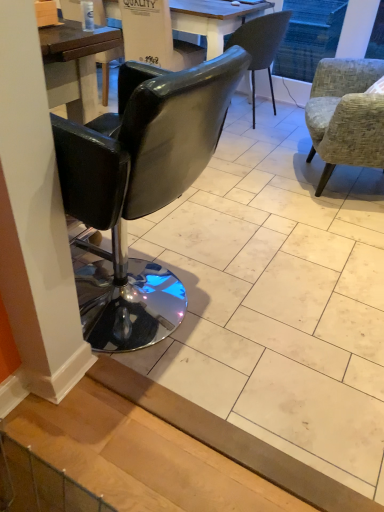
You are a GUI agent. You are given a task and a screenshot of the screen. Output one action in this format:
    pyautogui.click(x=<x>, y=<y>)
    Task: Click on the matte gray chair at center, acting as the 2th chair starting from the right
    
    Given the screenshot: What is the action you would take?
    pyautogui.click(x=261, y=45)

Locate an element on the screen. black leather armchair at center is located at coordinates (155, 36).

Considering the points (99, 219) and (271, 55), which point is in front, point (99, 219) or point (271, 55)?

The point (99, 219) is more forward.

From a real-world perspective, is black leather chair at left, which ranks as the 3th chair in right-to-left order, located higher than matte gray chair at center, marked as the 2th chair in a left-to-right arrangement?

Correct, in the physical world, black leather chair at left, which ranks as the 3th chair in right-to-left order, is higher than matte gray chair at center, marked as the 2th chair in a left-to-right arrangement.

Does black leather chair at left, acting as the first chair starting from the left, contain matte gray chair at center, acting as the 2th chair starting from the right?

No, matte gray chair at center, acting as the 2th chair starting from the right, is not inside black leather chair at left, acting as the first chair starting from the left.

Is matte gray chair at center, marked as the 2th chair in a left-to-right arrangement, not near black leather armchair at center?

That's not correct — matte gray chair at center, marked as the 2th chair in a left-to-right arrangement, is a little close to black leather armchair at center.

From a real-world perspective, is matte gray chair at center, marked as the 2th chair in a left-to-right arrangement, above or below black leather armchair at center?

matte gray chair at center, marked as the 2th chair in a left-to-right arrangement, is below black leather armchair at center.

From the picture: How distant is matte gray chair at center, acting as the first chair starting from the back, from black leather armchair at center?

A distance of 19.46 inches exists between matte gray chair at center, acting as the first chair starting from the back, and black leather armchair at center.

Is matte gray chair at center, acting as the 2th chair starting from the right, facing away from black leather armchair at center?

No, matte gray chair at center, acting as the 2th chair starting from the right,'s orientation is not away from black leather armchair at center.

Is point (256, 62) more distant than point (127, 210)?

Yes.

Which is more to the right, matte gray chair at center, acting as the 2th chair starting from the right, or black leather chair at left, marked as the first chair in a front-to-back arrangement?

From the viewer's perspective, matte gray chair at center, acting as the 2th chair starting from the right, appears more on the right side.

Is black leather chair at left, which is counted as the third chair, starting from the back, surrounded by matte gray chair at center, acting as the first chair starting from the back?

No, black leather chair at left, which is counted as the third chair, starting from the back, is not inside matte gray chair at center, acting as the first chair starting from the back.

In terms of size, does matte gray chair at center, marked as the 2th chair in a left-to-right arrangement, appear bigger or smaller than black leather chair at left, which is counted as the third chair, starting from the back?

matte gray chair at center, marked as the 2th chair in a left-to-right arrangement, is smaller than black leather chair at left, which is counted as the third chair, starting from the back.

Relative to textured gray fabric armchair at right, which ranks as the 3th chair in left-to-right order, is matte gray chair at center, acting as the first chair starting from the back, in front or behind?

Clearly, matte gray chair at center, acting as the first chair starting from the back, is behind textured gray fabric armchair at right, which ranks as the 3th chair in left-to-right order.

Is matte gray chair at center, marked as the 2th chair in a left-to-right arrangement, bigger than textured gray fabric armchair at right, which ranks as the 3th chair in left-to-right order?

No.

Is matte gray chair at center, acting as the first chair starting from the back, oriented towards textured gray fabric armchair at right, which ranks as the 3th chair in left-to-right order?

No, matte gray chair at center, acting as the first chair starting from the back, is not turned towards textured gray fabric armchair at right, which ranks as the 3th chair in left-to-right order.

Would you consider matte gray chair at center, acting as the 3th chair starting from the front, to be distant from textured gray fabric armchair at right, which is the 2th chair in front-to-back order?

No, matte gray chair at center, acting as the 3th chair starting from the front, is in close proximity to textured gray fabric armchair at right, which is the 2th chair in front-to-back order.

At what (x,y) coordinates should I click in order to perform the action: click on armchair in front of the matte gray chair at center, acting as the first chair starting from the back. Please return your answer as a coordinate pair (x, y). This screenshot has height=512, width=384. Looking at the image, I should click on (155, 36).

Does point (143, 26) come farther from viewer compared to point (263, 16)?

That is True.

From a real-world perspective, is black leather armchair at center under matte gray chair at center, acting as the 3th chair starting from the front?

No, from a real-world perspective, black leather armchair at center is not below matte gray chair at center, acting as the 3th chair starting from the front.

Would you say black leather armchair at center is to the left or to the right of matte gray chair at center, acting as the 2th chair starting from the right, in the picture?

black leather armchair at center is to the left of matte gray chair at center, acting as the 2th chair starting from the right.

From a real-world perspective, is black leather chair at left, which ranks as the 3th chair in right-to-left order, below black leather armchair at center?

Yes.

Would you say black leather chair at left, which ranks as the 3th chair in right-to-left order, contains black leather armchair at center?

No.

In the scene shown: Considering the relative sizes of textured gray fabric armchair at right, which ranks as the 3th chair in left-to-right order, and matte gray chair at center, acting as the first chair starting from the back, in the image provided, is textured gray fabric armchair at right, which ranks as the 3th chair in left-to-right order, smaller than matte gray chair at center, acting as the first chair starting from the back,?

Actually, textured gray fabric armchair at right, which ranks as the 3th chair in left-to-right order, might be larger than matte gray chair at center, acting as the first chair starting from the back.

Which of these two, textured gray fabric armchair at right, which ranks as the 3th chair in left-to-right order, or matte gray chair at center, acting as the 2th chair starting from the right, is thinner?

Thinner between the two is matte gray chair at center, acting as the 2th chair starting from the right.

Where is `chair that is the 1st object to the left of the textured gray fabric armchair at right, which is counted as the 2th chair, starting from the back, starting at the anchor`? The width and height of the screenshot is (384, 512). chair that is the 1st object to the left of the textured gray fabric armchair at right, which is counted as the 2th chair, starting from the back, starting at the anchor is located at coordinates (261, 45).

What are the coordinates of `chair above the matte gray chair at center, marked as the 2th chair in a left-to-right arrangement (from a real-world perspective)` in the screenshot? It's located at click(x=140, y=190).

Locate an element on the screen. This screenshot has width=384, height=512. armchair that appears above the matte gray chair at center, acting as the 3th chair starting from the front (from the image's perspective) is located at coordinates (155, 36).

When comparing their distances from black leather armchair at center, does matte gray chair at center, acting as the 2th chair starting from the right, or black leather chair at left, acting as the first chair starting from the left, seem closer?

matte gray chair at center, acting as the 2th chair starting from the right, is positioned closer to the anchor black leather armchair at center.

Which object lies nearer to the anchor point matte gray chair at center, acting as the 3th chair starting from the front, black leather chair at left, which ranks as the 3th chair in right-to-left order, or black leather armchair at center?

The object closer to matte gray chair at center, acting as the 3th chair starting from the front, is black leather armchair at center.

Estimate the real-world distances between objects in this image. Which object is closer to matte gray chair at center, acting as the 3th chair starting from the front, textured gray fabric armchair at right, which ranks as the 3th chair in left-to-right order, or black leather armchair at center?

black leather armchair at center lies closer to matte gray chair at center, acting as the 3th chair starting from the front, than the other object.

Consider the image. Considering their positions, is black leather armchair at center positioned closer to textured gray fabric armchair at right, which ranks as the 3th chair in left-to-right order, than black leather chair at left, which ranks as the 3th chair in right-to-left order?

Based on the image, black leather armchair at center appears to be nearer to textured gray fabric armchair at right, which ranks as the 3th chair in left-to-right order.

When comparing their distances from black leather armchair at center, does black leather chair at left, which ranks as the 3th chair in right-to-left order, or textured gray fabric armchair at right, which is the 2th chair in front-to-back order, seem further?

black leather chair at left, which ranks as the 3th chair in right-to-left order.

Estimate the real-world distances between objects in this image. Which object is further from textured gray fabric armchair at right, which is the 2th chair in front-to-back order, black leather chair at left, acting as the first chair starting from the left, or black leather armchair at center?

black leather chair at left, acting as the first chair starting from the left, is further to textured gray fabric armchair at right, which is the 2th chair in front-to-back order.

In the scene shown: Based on their spatial positions, is matte gray chair at center, acting as the first chair starting from the back, or black leather armchair at center further from textured gray fabric armchair at right, which ranks as the 3th chair in left-to-right order?

black leather armchair at center is positioned further to the anchor textured gray fabric armchair at right, which ranks as the 3th chair in left-to-right order.

From the image, which object appears to be nearer to black leather armchair at center, matte gray chair at center, marked as the 2th chair in a left-to-right arrangement, or textured gray fabric armchair at right, which is the 2th chair in front-to-back order?

The object closer to black leather armchair at center is matte gray chair at center, marked as the 2th chair in a left-to-right arrangement.

You are a GUI agent. You are given a task and a screenshot of the screen. Output one action in this format:
    pyautogui.click(x=<x>, y=<y>)
    Task: Click on the armchair between black leather chair at left, which ranks as the 3th chair in right-to-left order, and matte gray chair at center, acting as the first chair starting from the back, along the z-axis
    The width and height of the screenshot is (384, 512).
    Given the screenshot: What is the action you would take?
    [155, 36]

Locate an element on the screen. chair between black leather chair at left, acting as the first chair starting from the left, and matte gray chair at center, marked as the 2th chair in a left-to-right arrangement, from front to back is located at coordinates (345, 115).

The height and width of the screenshot is (512, 384). Find the location of `chair between black leather chair at left, which is counted as the third chair, starting from the back, and black leather armchair at center in the front-back direction`. chair between black leather chair at left, which is counted as the third chair, starting from the back, and black leather armchair at center in the front-back direction is located at coordinates (345, 115).

The height and width of the screenshot is (512, 384). What are the coordinates of `chair between black leather armchair at center and textured gray fabric armchair at right, which ranks as the 3th chair in left-to-right order` in the screenshot? It's located at (261, 45).